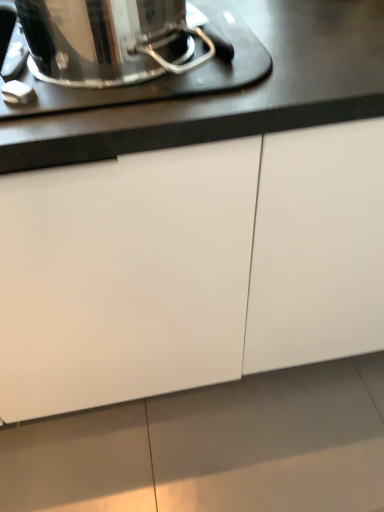
Question: Does white glossy tile at lower center come in front of white matte cabinet at center?

Choices:
 (A) yes
 (B) no

Answer: (B)

Question: Is white glossy tile at lower center beside white matte cabinet at center?

Choices:
 (A) yes
 (B) no

Answer: (B)

Question: Is white glossy tile at lower center not inside white matte cabinet at center?

Choices:
 (A) no
 (B) yes

Answer: (B)

Question: From a real-world perspective, does white glossy tile at lower center sit lower than white matte cabinet at center?

Choices:
 (A) no
 (B) yes

Answer: (B)

Question: Is white glossy tile at lower center taller than white matte cabinet at center?

Choices:
 (A) yes
 (B) no

Answer: (B)

Question: Can you confirm if white glossy tile at lower center is wider than white matte cabinet at center?

Choices:
 (A) yes
 (B) no

Answer: (A)

Question: From a real-world perspective, does polished stainless steel pot at upper left stand above white glossy tile at lower center?

Choices:
 (A) yes
 (B) no

Answer: (A)

Question: Is polished stainless steel pot at upper left at the right side of white glossy tile at lower center?

Choices:
 (A) no
 (B) yes

Answer: (A)

Question: Considering the relative sizes of polished stainless steel pot at upper left and white glossy tile at lower center in the image provided, is polished stainless steel pot at upper left bigger than white glossy tile at lower center?

Choices:
 (A) no
 (B) yes

Answer: (A)

Question: Can you confirm if polished stainless steel pot at upper left is thinner than white glossy tile at lower center?

Choices:
 (A) yes
 (B) no

Answer: (A)

Question: Is polished stainless steel pot at upper left not within white glossy tile at lower center?

Choices:
 (A) no
 (B) yes

Answer: (B)

Question: Is white glossy tile at lower center surrounded by polished stainless steel pot at upper left?

Choices:
 (A) no
 (B) yes

Answer: (A)

Question: Is white glossy tile at lower center shorter than polished stainless steel pot at upper left?

Choices:
 (A) no
 (B) yes

Answer: (B)